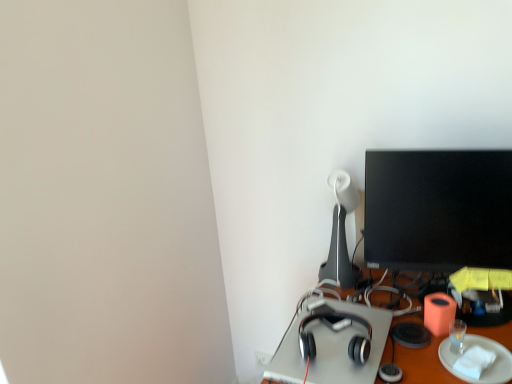
Question: Is black glossy monitor at upper right further to camera compared to white paper plate at lower right?

Choices:
 (A) no
 (B) yes

Answer: (B)

Question: Is black glossy monitor at upper right at the left side of white paper plate at lower right?

Choices:
 (A) yes
 (B) no

Answer: (A)

Question: From a real-world perspective, is black glossy monitor at upper right under white paper plate at lower right?

Choices:
 (A) yes
 (B) no

Answer: (B)

Question: Considering the relative sizes of black glossy monitor at upper right and white paper plate at lower right in the image provided, is black glossy monitor at upper right bigger than white paper plate at lower right?

Choices:
 (A) no
 (B) yes

Answer: (B)

Question: Does black glossy monitor at upper right have a greater width compared to white paper plate at lower right?

Choices:
 (A) yes
 (B) no

Answer: (B)

Question: Could you tell me if black glossy monitor at upper right is facing white paper plate at lower right?

Choices:
 (A) no
 (B) yes

Answer: (A)

Question: Is white glossy table lamp at upper right to the left of black glossy monitor at upper right from the viewer's perspective?

Choices:
 (A) yes
 (B) no

Answer: (A)

Question: From the image's perspective, does white glossy table lamp at upper right appear higher than black glossy monitor at upper right?

Choices:
 (A) no
 (B) yes

Answer: (A)

Question: Is white glossy table lamp at upper right next to black glossy monitor at upper right?

Choices:
 (A) no
 (B) yes

Answer: (A)

Question: From the image's perspective, does white glossy table lamp at upper right appear lower than black glossy monitor at upper right?

Choices:
 (A) no
 (B) yes

Answer: (B)

Question: Is white glossy table lamp at upper right wider than black glossy monitor at upper right?

Choices:
 (A) no
 (B) yes

Answer: (B)

Question: Could you tell me if white glossy table lamp at upper right is facing black glossy monitor at upper right?

Choices:
 (A) no
 (B) yes

Answer: (A)

Question: Is white paper plate at lower right closer to the viewer compared to white glossy table lamp at upper right?

Choices:
 (A) no
 (B) yes

Answer: (B)